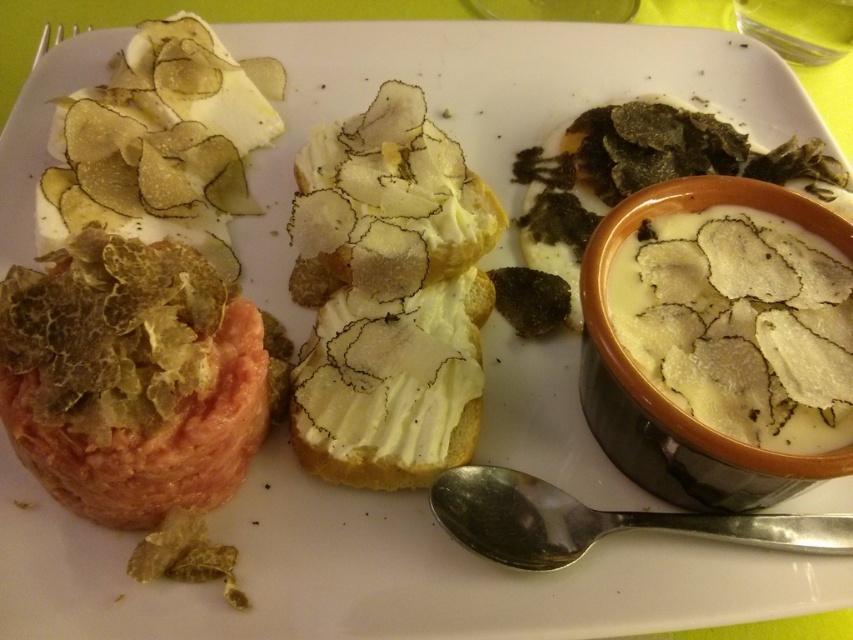
You are a food critic who wants to taste the black matte truffle at upper right and the silver metallic spoon at lower center. Which one is taller?

The black matte truffle at upper right is taller than the silver metallic spoon at lower center.

You are a food critic evaluating the presentation of this dish. You notice the black matte truffle at upper right and the silver metallic spoon at lower center. Which object is smaller in width?

The black matte truffle at upper right is smaller in width than the silver metallic spoon at lower center.

You are a food critic examining the plate. You want to taste the black matte truffle at upper right and the silver metallic spoon at lower center. Which item is closer to your hand when you reach out to grab them?

The black matte truffle at upper right is closer to your hand because it is further to the viewer than the silver metallic spoon at lower center, meaning it is positioned nearer in the visual field.